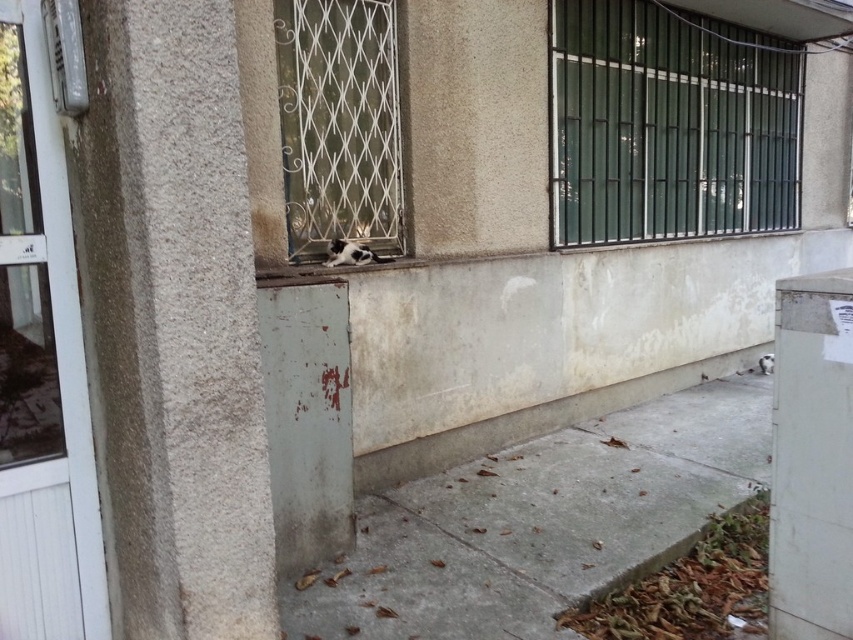
Which is behind, point (735, 429) or point (343, 260)?

Point (735, 429)

Can you confirm if gray concrete pavement at lower right is thinner than black and white fur cat at center?

In fact, gray concrete pavement at lower right might be wider than black and white fur cat at center.

Which is behind, point (340, 614) or point (345, 259)?

The point (345, 259) is more distant.

Locate an element on the screen. gray concrete pavement at lower right is located at coordinates (541, 522).

Is the position of green metal bars at upper right less distant than that of metallic mesh window at center?

No, it is not.

What do you see at coordinates (669, 124) in the screenshot? This screenshot has width=853, height=640. I see `green metal bars at upper right` at bounding box center [669, 124].

Identify the location of green metal bars at upper right. (669, 124).

Measure the distance from metallic mesh window at center to black and white fur cat at center.

The distance of metallic mesh window at center from black and white fur cat at center is 13.56 inches.

Find the location of a particular element. metallic mesh window at center is located at coordinates (339, 124).